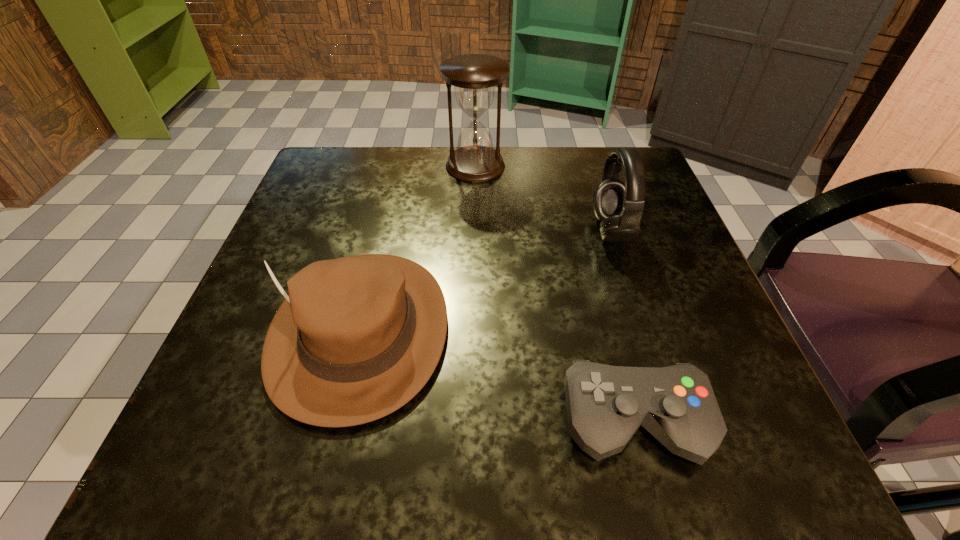
Where is `object that is at the near right corner`? This screenshot has height=540, width=960. object that is at the near right corner is located at coordinates coord(606,405).

At what (x,y) coordinates should I click in order to perform the action: click on vacant space at the far edge. Please return your answer as a coordinate pair (x, y). Looking at the image, I should click on (519, 162).

This screenshot has height=540, width=960. Find the location of `free spot at the near edge of the desktop`. free spot at the near edge of the desktop is located at coordinates (477, 418).

Where is `free space at the left edge of the desktop`? This screenshot has width=960, height=540. free space at the left edge of the desktop is located at coordinates (353, 249).

In the image, there is a desktop. Identify the location of free space at the right edge. (613, 281).

Find the location of a particular element. Image resolution: width=960 pixels, height=540 pixels. free space at the far left corner of the desktop is located at coordinates (301, 196).

The width and height of the screenshot is (960, 540). In order to click on vacant area at the near right corner in this screenshot , I will do `click(726, 413)`.

Image resolution: width=960 pixels, height=540 pixels. I want to click on free spot between the headset and the shortest object, so click(622, 326).

The image size is (960, 540). What are the coordinates of `vacant area between the headset and the tallest object` in the screenshot? It's located at (543, 198).

Identify the location of unoccupied area between the shortest object and the hourglass. The height and width of the screenshot is (540, 960). (555, 294).